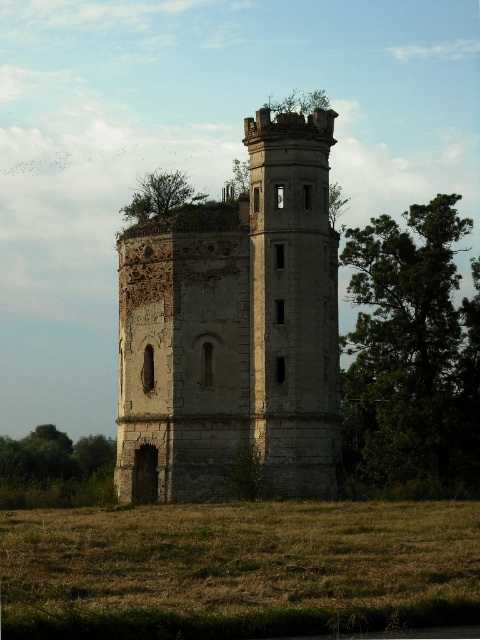
Question: Can you confirm if green leafy tree at right is positioned to the right of green leafy tree at lower left?

Choices:
 (A) no
 (B) yes

Answer: (B)

Question: Which object is positioned closest to the green leafy tree at lower left?

Choices:
 (A) weathered stone tower at center
 (B) brown grass at lower center
 (C) green leafy tree at right

Answer: (A)

Question: Is the position of brown grass at lower center more distant than that of green leafy tree at lower left?

Choices:
 (A) no
 (B) yes

Answer: (A)

Question: Which of the following is the closest to the observer?

Choices:
 (A) (171, 198)
 (B) (29, 573)
 (C) (32, 440)
 (D) (170, 307)

Answer: (B)

Question: Which object is closer to the camera taking this photo?

Choices:
 (A) green leafy tree at upper center
 (B) weathered stone tower at center
 (C) brown grass at lower center

Answer: (C)

Question: Can you confirm if weathered stone tower at center is positioned to the right of green leafy tree at right?

Choices:
 (A) no
 (B) yes

Answer: (A)